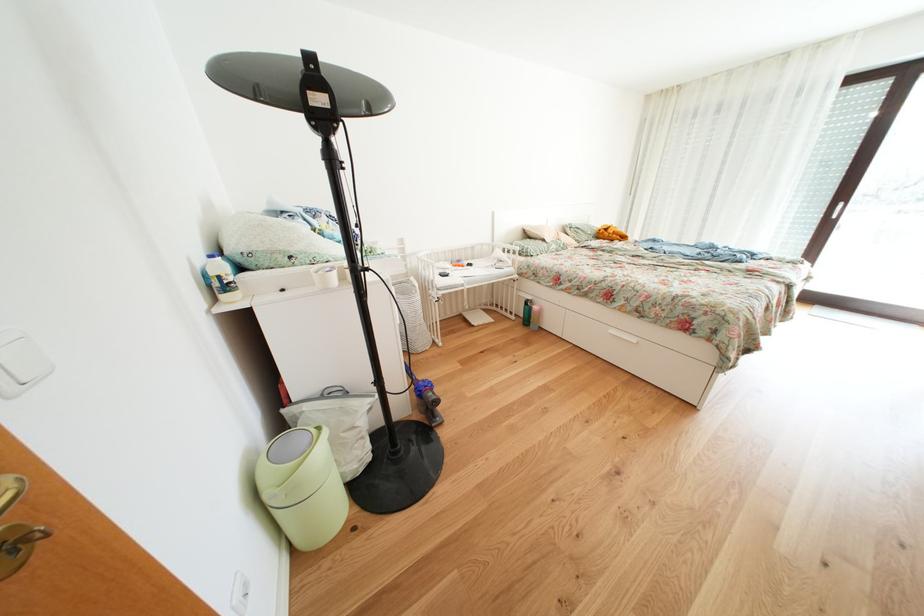
Which object does [535,315] point to?

It refers to a pink water bottle.